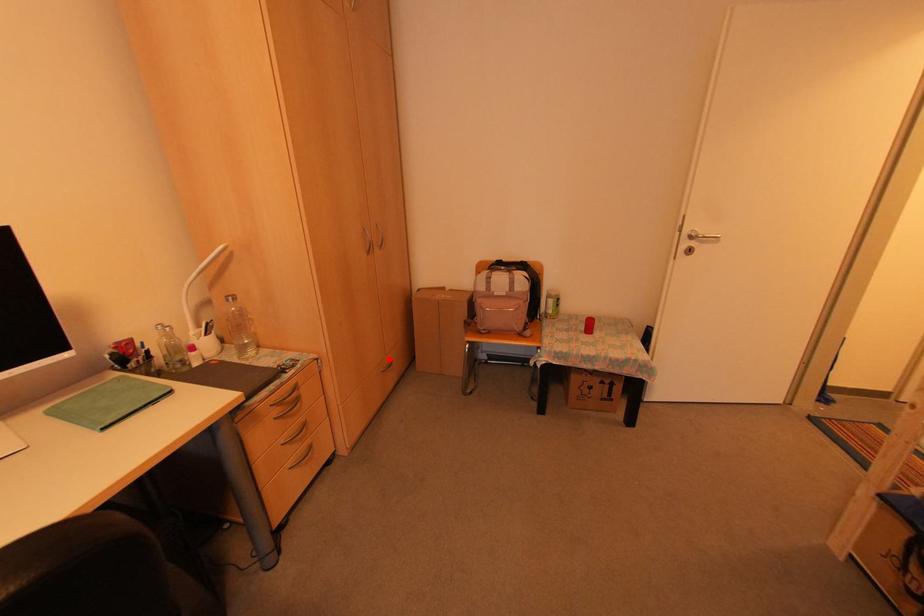
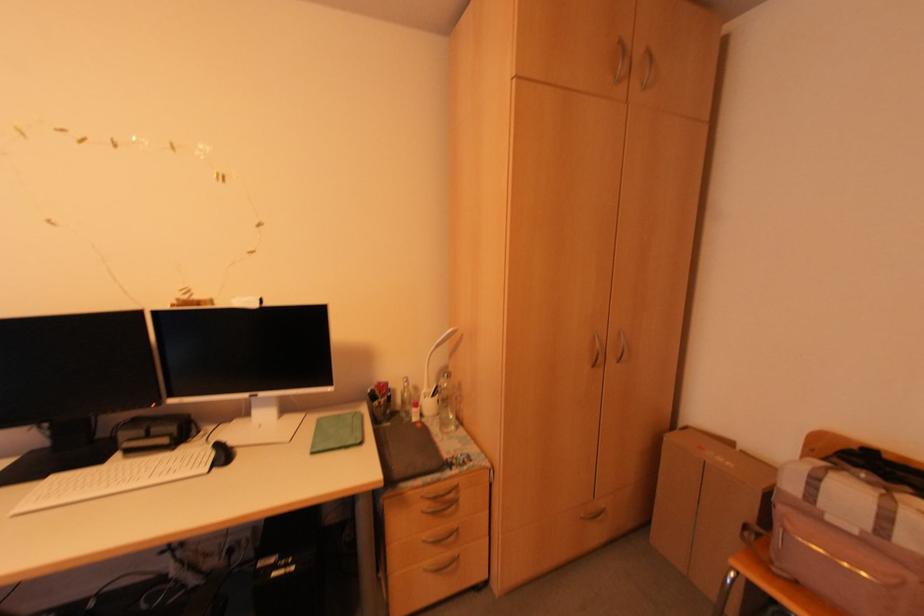
In the second image, find the point that corresponds to the highlighted location in the first image.

(602, 506)